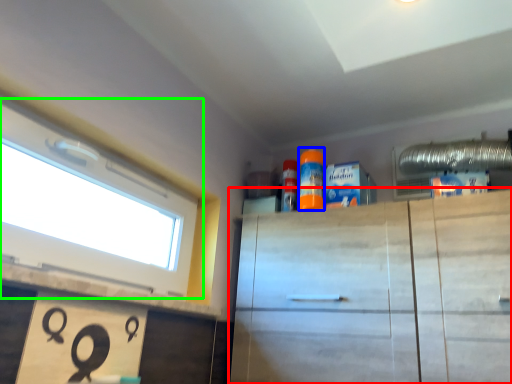
Question: Based on their relative distances, which object is nearer to cabinetry (highlighted by a red box)? Choose from cleaning product (highlighted by a blue box) and window (highlighted by a green box).

Choices:
 (A) cleaning product
 (B) window

Answer: (A)